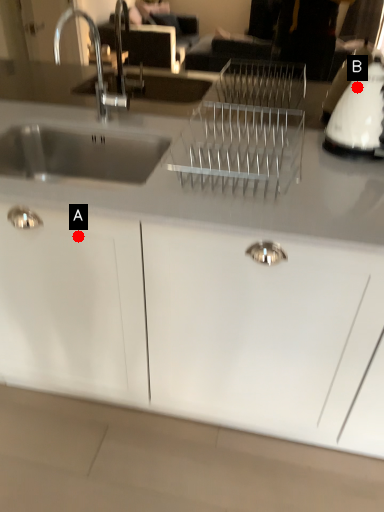
Question: Two points are circled on the image, labeled by A and B beside each circle. Which point appears closest to the camera in this image?

Choices:
 (A) A is closer
 (B) B is closer

Answer: (A)